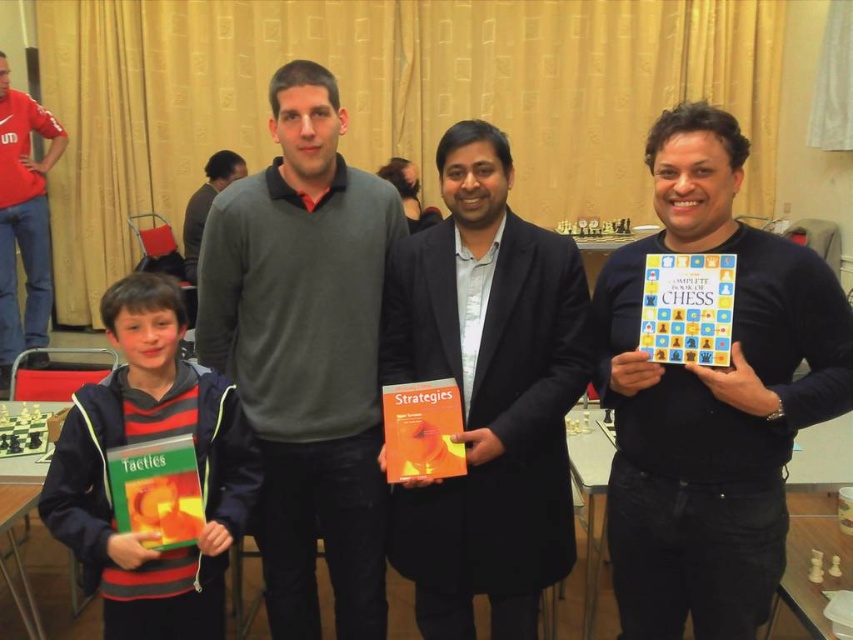
Question: Which object appears farthest from the camera in this image?

Choices:
 (A) orange matte strategies book at center
 (B) striped fabric jacket at lower left
 (C) brushed metal shirt at upper left
 (D) matte black suit at center

Answer: (C)

Question: Does matte black suit at center have a greater width compared to brushed metal shirt at upper left?

Choices:
 (A) no
 (B) yes

Answer: (B)

Question: Which point is closer to the camera taking this photo?

Choices:
 (A) (361, 275)
 (B) (390, 435)
 (C) (730, 330)
 (D) (141, 540)

Answer: (C)

Question: Is black matte book at center positioned in front of orange matte strategies book at center?

Choices:
 (A) no
 (B) yes

Answer: (B)

Question: Can you confirm if brushed metal shirt at upper left is thinner than orange matte strategies book at center?

Choices:
 (A) yes
 (B) no

Answer: (B)

Question: Which object appears farthest from the camera in this image?

Choices:
 (A) hardcover tactics book at lower left
 (B) dark gray sweater at center
 (C) striped fabric jacket at lower left
 (D) matte black suit at center

Answer: (B)